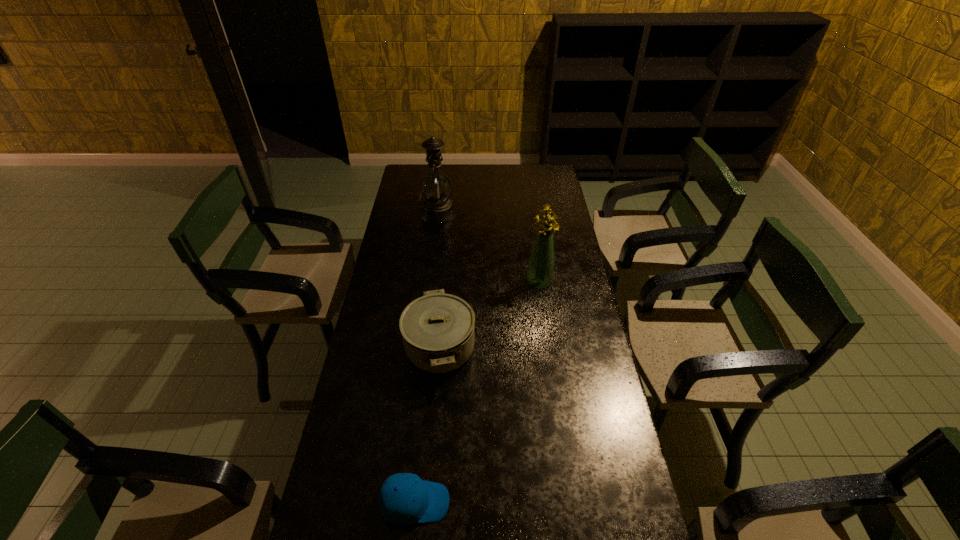
Locate an element on the screen. The width and height of the screenshot is (960, 540). the farthest object is located at coordinates (436, 188).

Locate an element on the screen. Image resolution: width=960 pixels, height=540 pixels. the rightmost object is located at coordinates (540, 271).

Find the location of a particular element. bouquet is located at coordinates (540, 271).

The image size is (960, 540). I want to click on the second shortest object, so tap(437, 329).

What are the coordinates of `the third farthest object` in the screenshot? It's located at (437, 329).

I want to click on the nearest object, so (404, 498).

Where is `the shortest object`? The width and height of the screenshot is (960, 540). the shortest object is located at coordinates (404, 498).

Identify the location of free point located 0.100m on the left of the farthest object. (399, 213).

The image size is (960, 540). Identify the location of free space located 0.250m on the front-facing side of the third nearest object. (547, 341).

Find the location of a particular element. This screenshot has width=960, height=540. vacant area situated on the right of the saucepan is located at coordinates (538, 349).